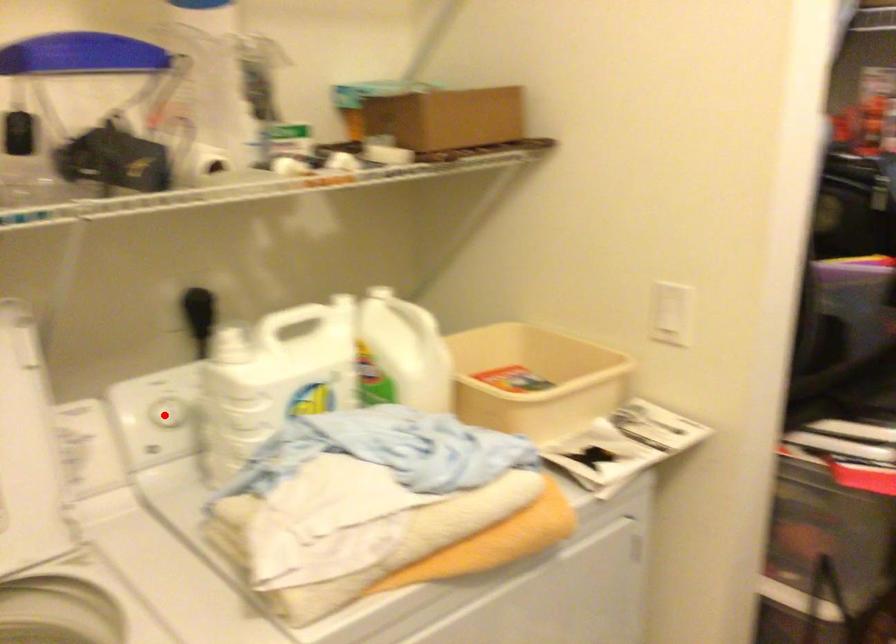
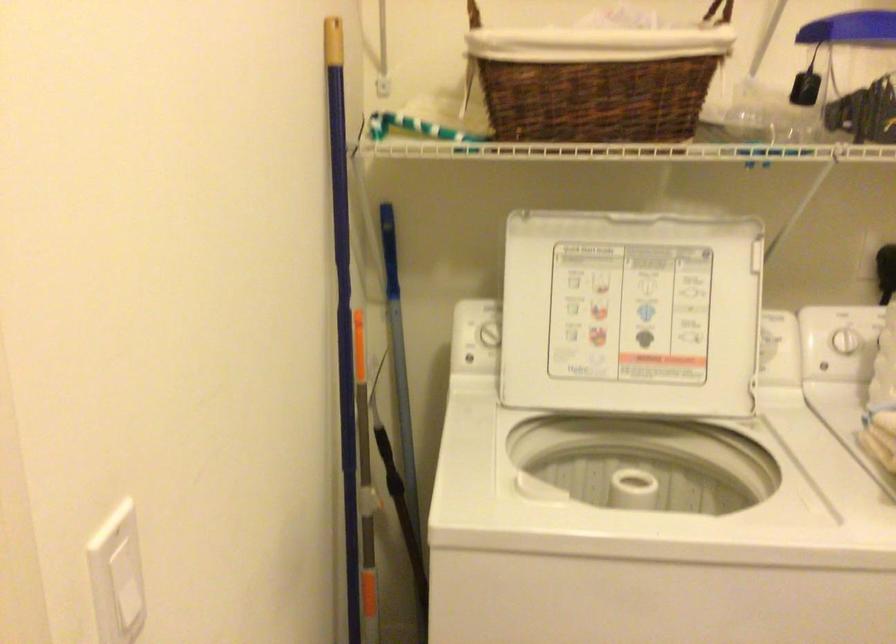
Question: I am providing you with two images of the same scene from different viewpoints. Given a red point in image1, look at the same physical point in image2. Is it:

Choices:
 (A) Closer to the viewpoint
 (B) Farther from the viewpoint

Answer: (B)